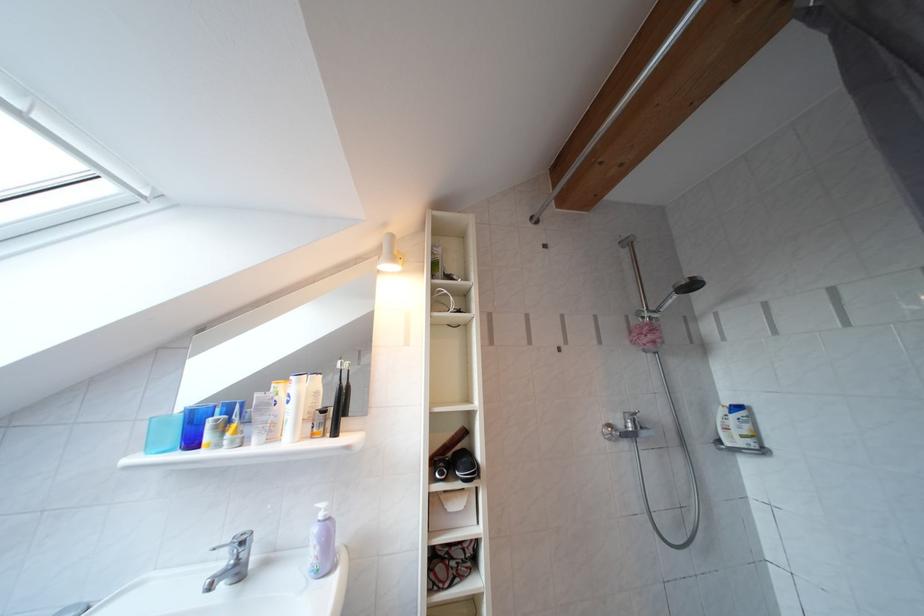
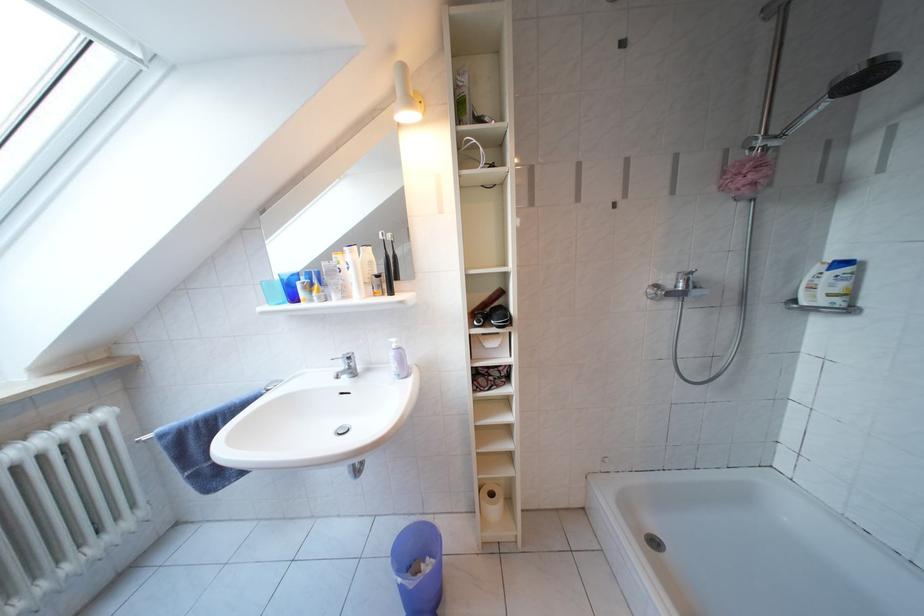
In the second image, find the point that corresponds to pixel 759 447 in the first image.

(846, 306)